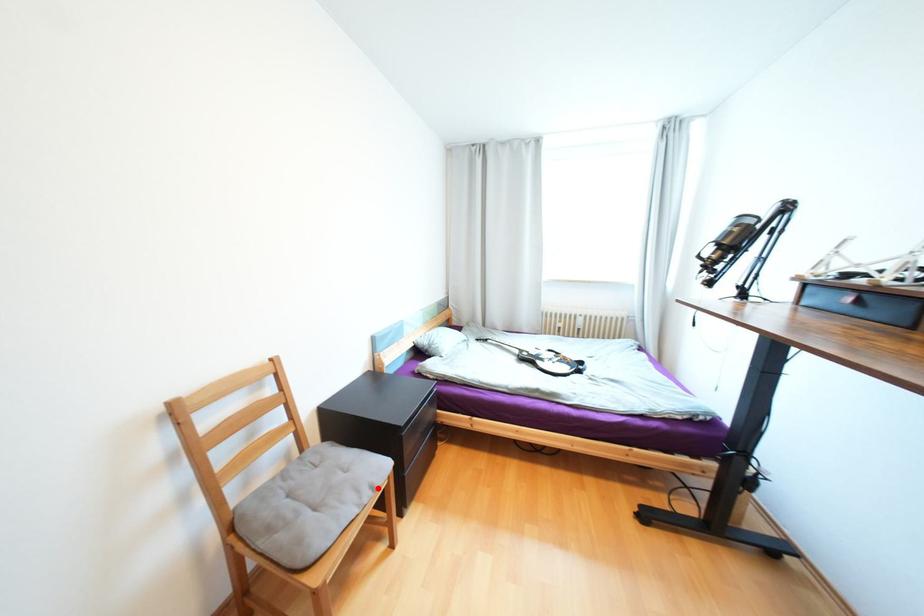
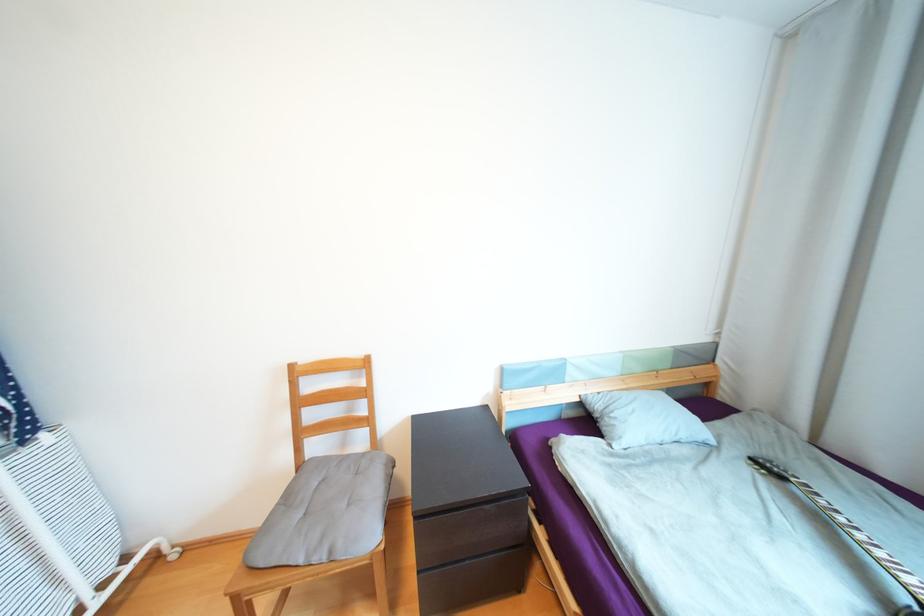
The point at the highlighted location is marked in the first image. Where is the corresponding point in the second image?

(335, 553)